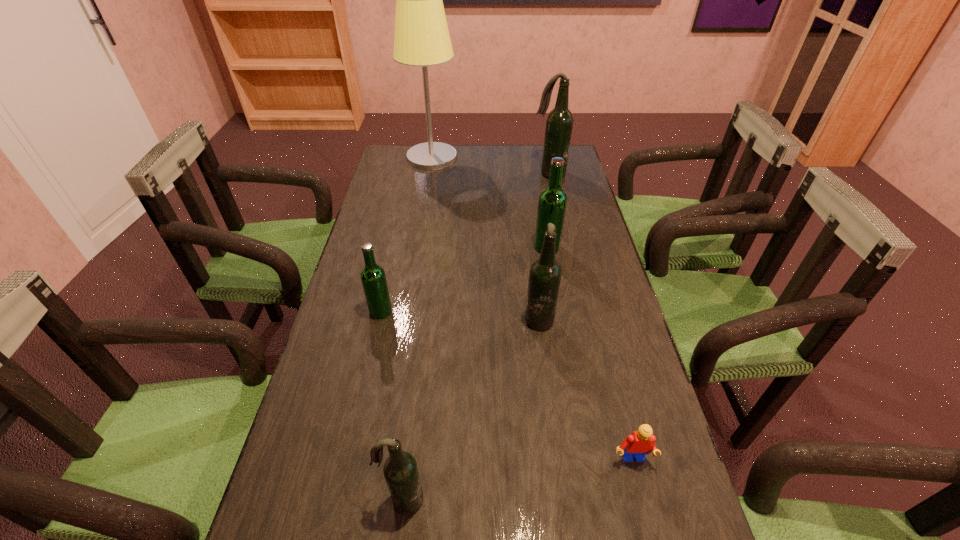
The image size is (960, 540). I want to click on the nearest dark beer bottle, so click(401, 474).

Locate an element on the screen. red Lego is located at coordinates (641, 442).

I want to click on the shortest object, so click(x=641, y=442).

Where is `free location located on the right of the tallest object`? The width and height of the screenshot is (960, 540). free location located on the right of the tallest object is located at coordinates (478, 157).

Locate an element on the screen. This screenshot has height=540, width=960. vacant space situated 0.050m on the back of the farthest beer bottle is located at coordinates (546, 161).

What are the coordinates of `vacant space positioned 0.310m on the left of the right green beer bottle` in the screenshot? It's located at (434, 247).

I want to click on vacant space located on the left of the second biggest dark beer bottle, so (479, 316).

Find the location of a particular element. This screenshot has width=960, height=540. vacant point located on the front of the nearer green beer bottle is located at coordinates (x=357, y=418).

Locate an element on the screen. The image size is (960, 540). free space located 0.090m on the left of the leftmost dark beer bottle is located at coordinates (333, 500).

Where is `vacant space located on the front-facing side of the red Lego`? vacant space located on the front-facing side of the red Lego is located at coordinates (643, 508).